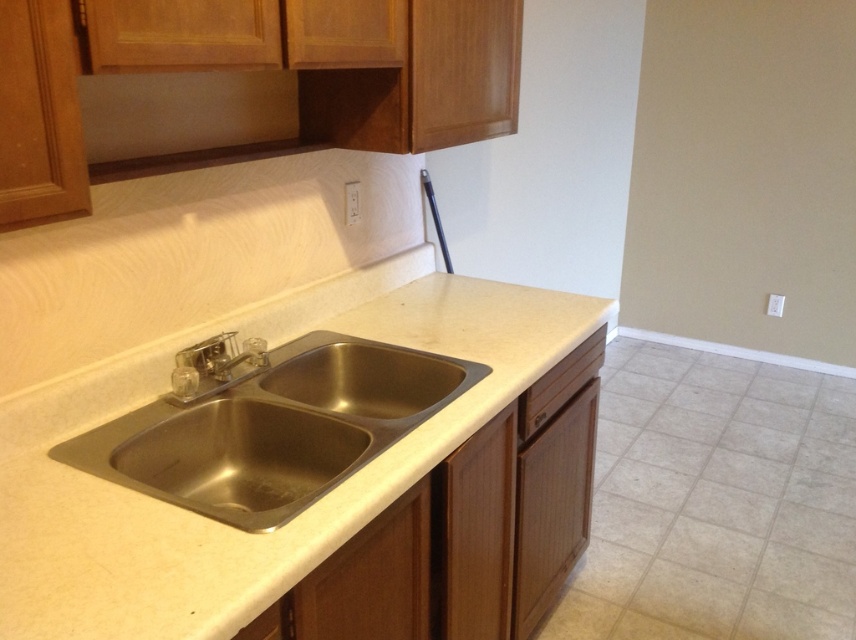
You are standing in the kitchen and want to reach a point that is 1.20 meters away from you. Is the point at coordinate point [82,493] within your reach?

The distance of point [82,493] from camera is 1.20 meters. Since the point is exactly 1.20 meters away from your position, it is within your reach if you can extend your arm that far.

You are a kitchen designer planning to install a new faucet. The existing stainless steel sink at center is located at coordinates 0.670, 0.320. If the faucet needs to be placed 10 cm to the right of the sink, what would be the new coordinates for the faucet?

The new coordinates for the faucet would be approximately (272, 492), as moving 10 cm to the right from the stainless steel sink at center at (272, 428) adds 0.100 to the x coordinate while keeping the y coordinate the same.

You are a delivery person trying to place a new matte brown exhaust hood at upper center in the kitchen. The current exhaust hood is located at point (183, 115). Where should you place the new one?

The new matte brown exhaust hood at upper center should be placed at point (183, 115) as that is where the existing one is located.